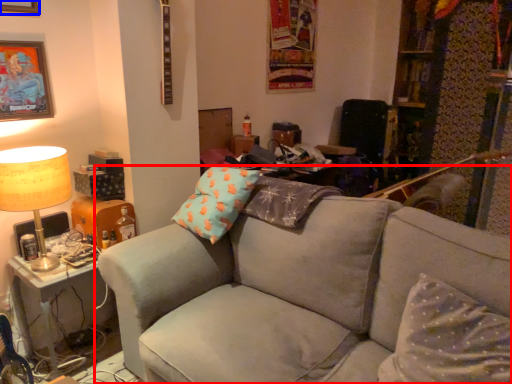
Question: Which point is further to the camera, studio couch (highlighted by a red box) or picture frame (highlighted by a blue box)?

Choices:
 (A) studio couch
 (B) picture frame

Answer: (B)